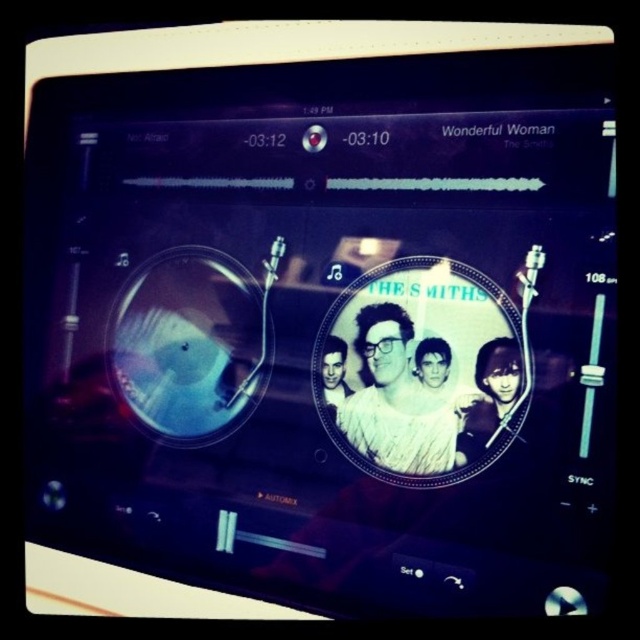
You are a music producer analyzing the DJ interface. The interface has a white textured shirt at center and a black and white photo of person at center. Which object occupies more vertical space in the DJ interface?

The white textured shirt at center is taller than the black and white photo of person at center, so it occupies more vertical space.

You are a DJ using this software and notice two elements on the screen. One is the black glossy vinyl record at center and the other is the smooth skin face at center. Which of these two elements is located below the other?

The black glossy vinyl record at center is positioned under smooth skin face at center, so the vinyl record is below the face.